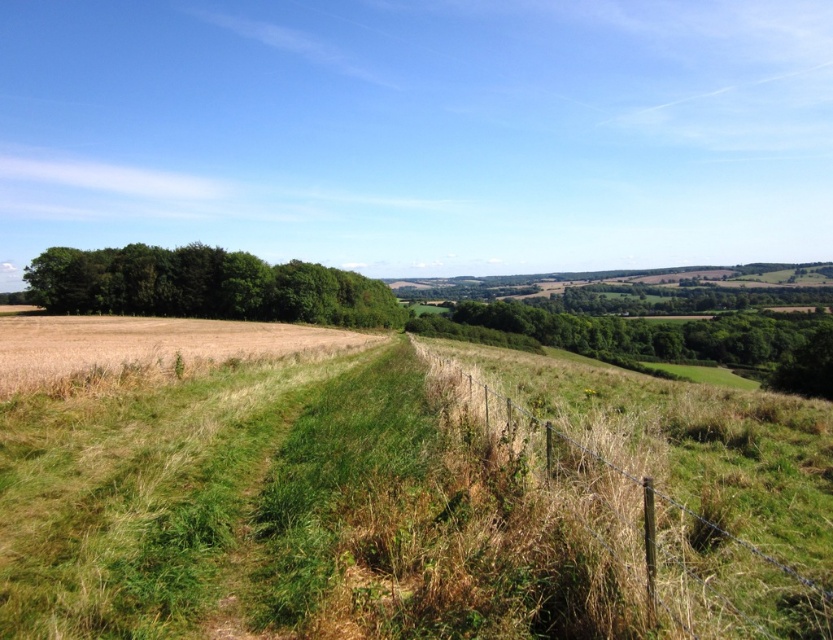
You are a farmer assessing the land. You see the green leafy trees at left and the golden matte wheat field at left. Which area covers a wider space in the image?

The green leafy trees at left cover a wider space in the image because their width is larger than the golden matte wheat field at left.